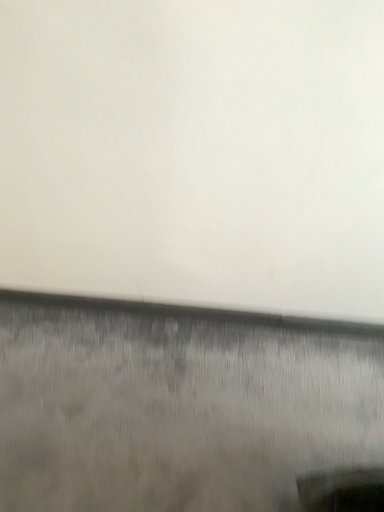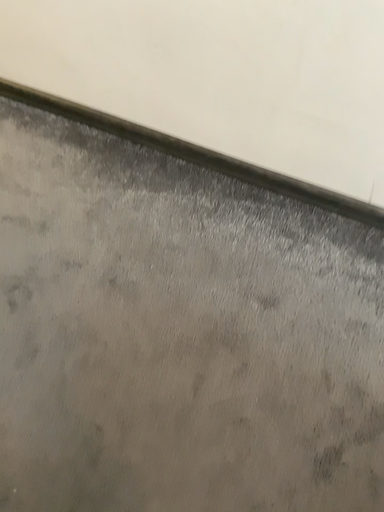
Question: How did the camera likely rotate when shooting the video?

Choices:
 (A) rotated upward
 (B) rotated downward

Answer: (B)